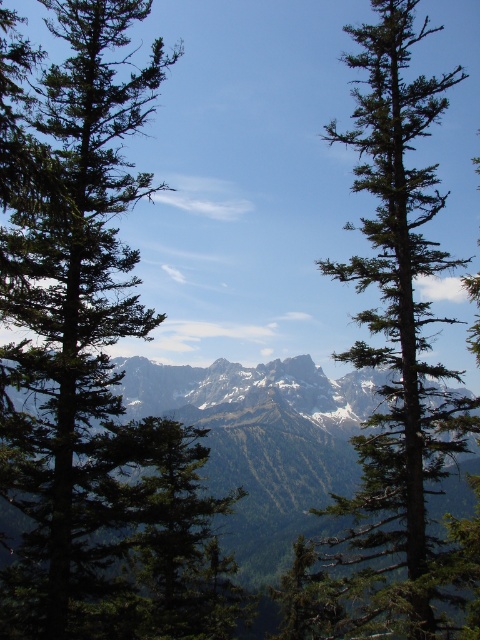
Between point (112, 364) and point (381, 170), which one is positioned behind?

The point (112, 364) is behind.

Is point (69, 83) in front of point (394, 362)?

Yes, point (69, 83) is in front of point (394, 362).

Identify the location of green matte tree at center. (x=73, y=321).